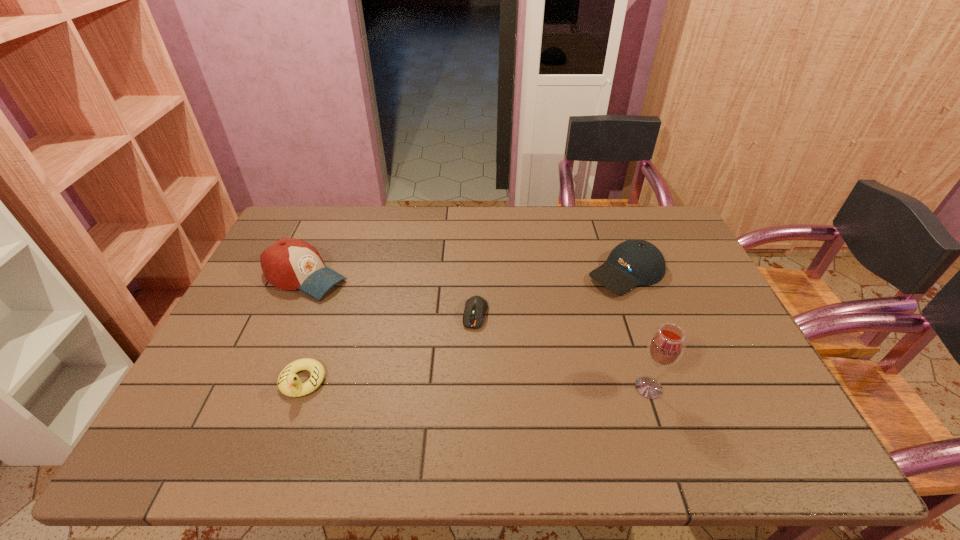
Where is `free space that satisfies the following two spatial constraints: 1. on the front side of the taller baseball cap; 2. on the right side of the tallest object`? The image size is (960, 540). free space that satisfies the following two spatial constraints: 1. on the front side of the taller baseball cap; 2. on the right side of the tallest object is located at coordinates (256, 388).

Identify the location of vacant area in the image that satisfies the following two spatial constraints: 1. on the back side of the third tallest object; 2. on the left side of the wineglass. (611, 273).